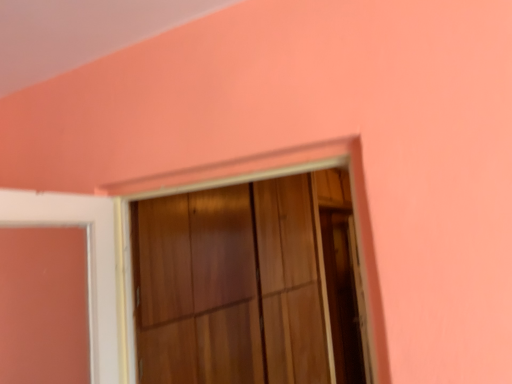
Question: Is point (221, 178) closer or farther from the camera than point (348, 324)?

Choices:
 (A) farther
 (B) closer

Answer: (B)

Question: In the image, is wooden frame at center positioned in front of or behind transparent glass screen door at right?

Choices:
 (A) front
 (B) behind

Answer: (A)

Question: From their relative heights in the image, would you say wooden frame at center is taller or shorter than transparent glass screen door at right?

Choices:
 (A) short
 (B) tall

Answer: (A)

Question: Is transparent glass screen door at right taller or shorter than wooden frame at center?

Choices:
 (A) short
 (B) tall

Answer: (B)

Question: From the image's perspective, is transparent glass screen door at right located above or below wooden frame at center?

Choices:
 (A) below
 (B) above

Answer: (A)

Question: Considering the positions of point (327, 218) and point (297, 152), is point (327, 218) closer or farther from the camera than point (297, 152)?

Choices:
 (A) farther
 (B) closer

Answer: (A)

Question: Considering the positions of transparent glass screen door at right and wooden frame at center in the image, is transparent glass screen door at right wider or thinner than wooden frame at center?

Choices:
 (A) thin
 (B) wide

Answer: (A)